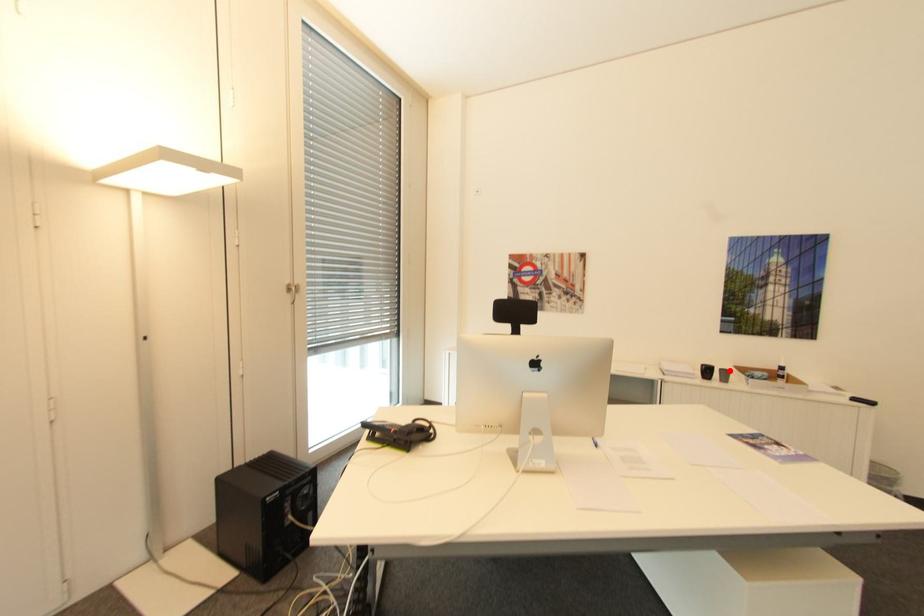
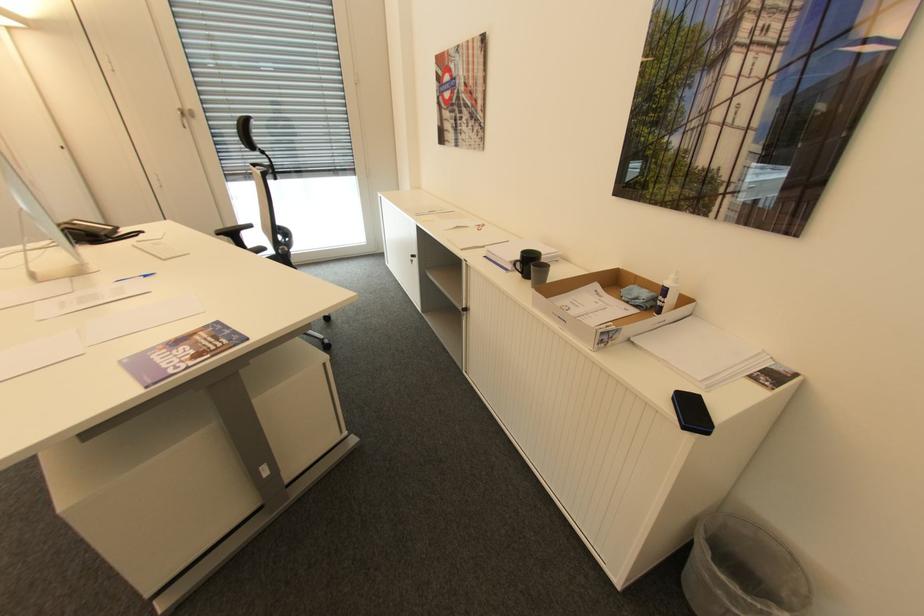
The point at the highlighted location is marked in the first image. Where is the corresponding point in the second image?

(550, 268)